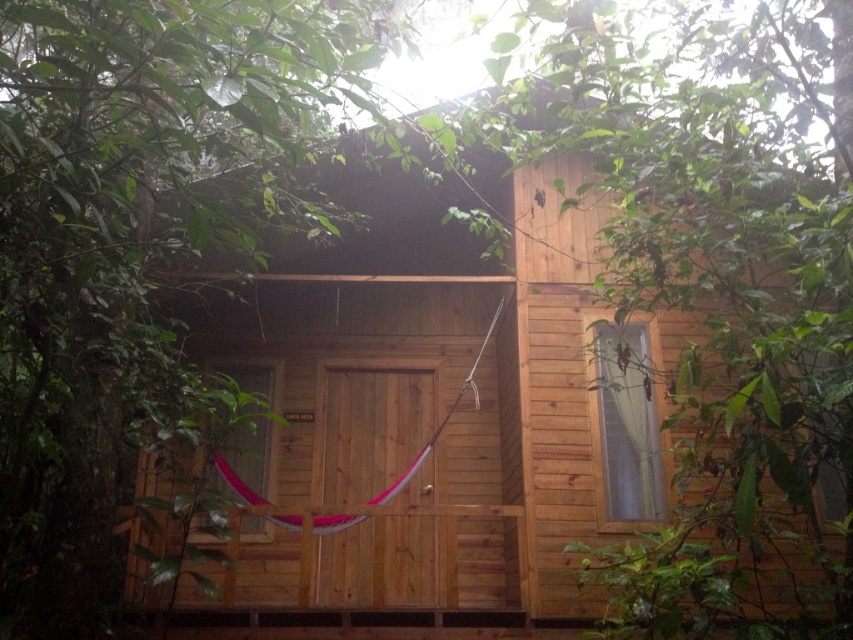
Does natural wood cabin at center have a larger size compared to green wood tree at center?

Actually, natural wood cabin at center might be smaller than green wood tree at center.

How much distance is there between natural wood cabin at center and green wood tree at center?

Answer: natural wood cabin at center and green wood tree at center are 7.44 feet apart.

Is point (376, 435) closer to camera compared to point (57, 552)?

No, it is behind (57, 552).

This screenshot has width=853, height=640. I want to click on natural wood cabin at center, so click(x=550, y=404).